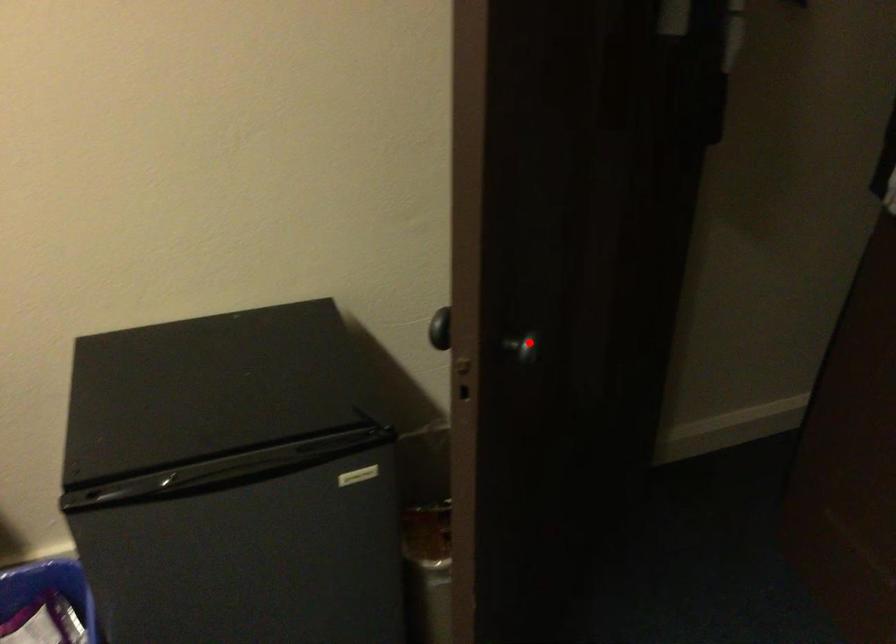
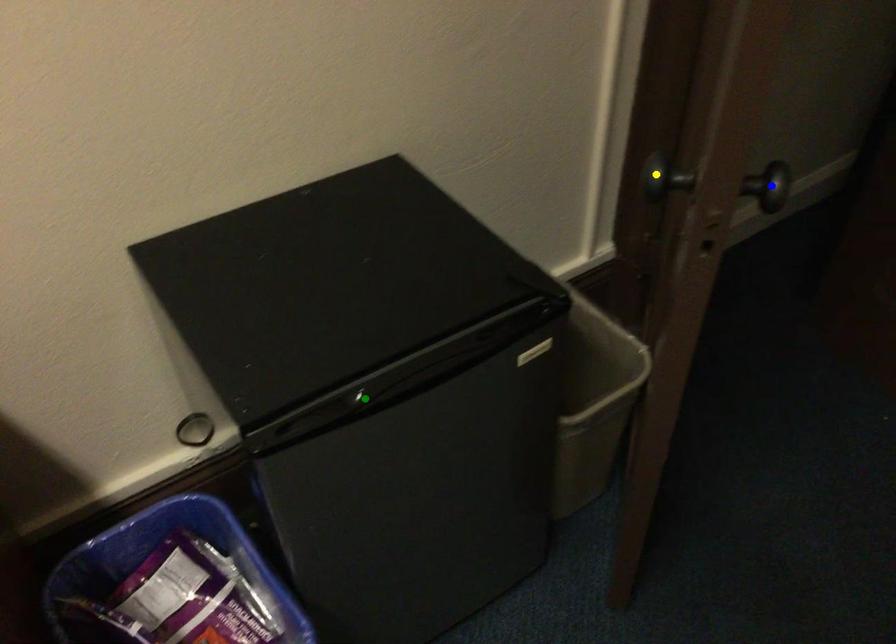
Question: I am providing you with two images of the same scene from different viewpoints. A red point is marked on the first image. You are given multiple points on the second image. Which spot in image 2 lines up with the point in image 1?

Choices:
 (A) yellow point
 (B) green point
 (C) blue point

Answer: (C)